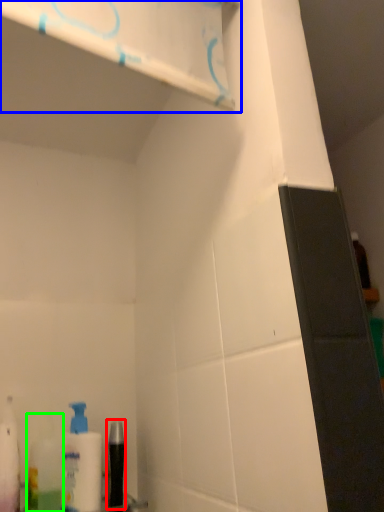
Question: Which object is positioned closest to mouthwash (highlighted by a red box)? Select from shelf (highlighted by a blue box) and mouthwash (highlighted by a green box).

Choices:
 (A) shelf
 (B) mouthwash

Answer: (B)